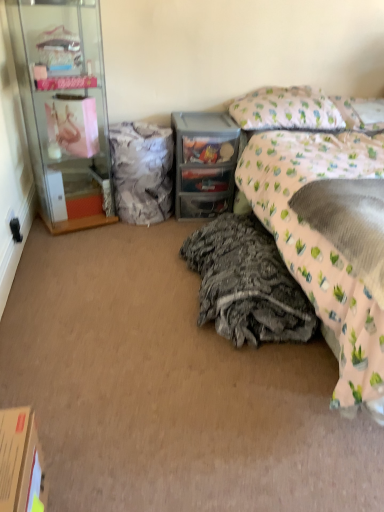
Question: Based on their positions, is textured gray blanket at lower center, placed as the first material when sorted from front to back, located to the left or right of pink fabric at right?

Choices:
 (A) left
 (B) right

Answer: (A)

Question: Is textured gray blanket at lower center, placed as the first material when sorted from front to back, inside the boundaries of pink fabric at right, or outside?

Choices:
 (A) inside
 (B) outside

Answer: (B)

Question: Which object is the farthest from the cardboard box at lower left?

Choices:
 (A) translucent plastic drawer at center
 (B) white fabric pillow at upper right, which is counted as the 2th pillow, starting from the left
 (C) white textured fabric at center, arranged as the 2th material when ordered from the bottom
 (D) clear glass cabinet at left
 (E) floral fabric bed at right

Answer: (B)

Question: Considering the real-world distances, which object is closest to the black plastic power outlet at lower left?

Choices:
 (A) cardboard box at lower left
 (B) white fabric pillow at upper right, which is the first pillow from right to left
 (C) floral fabric bed at right
 (D) textured gray blanket at lower center, which ranks as the second material in top-to-bottom order
 (E) clear glass cabinet at left

Answer: (E)